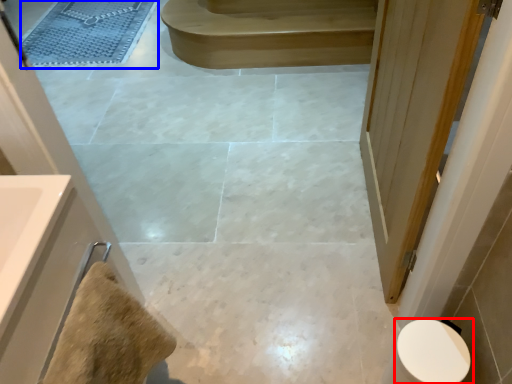
Question: Which point is further to the camera, toilet (highlighted by a red box) or bath mat (highlighted by a blue box)?

Choices:
 (A) toilet
 (B) bath mat

Answer: (B)